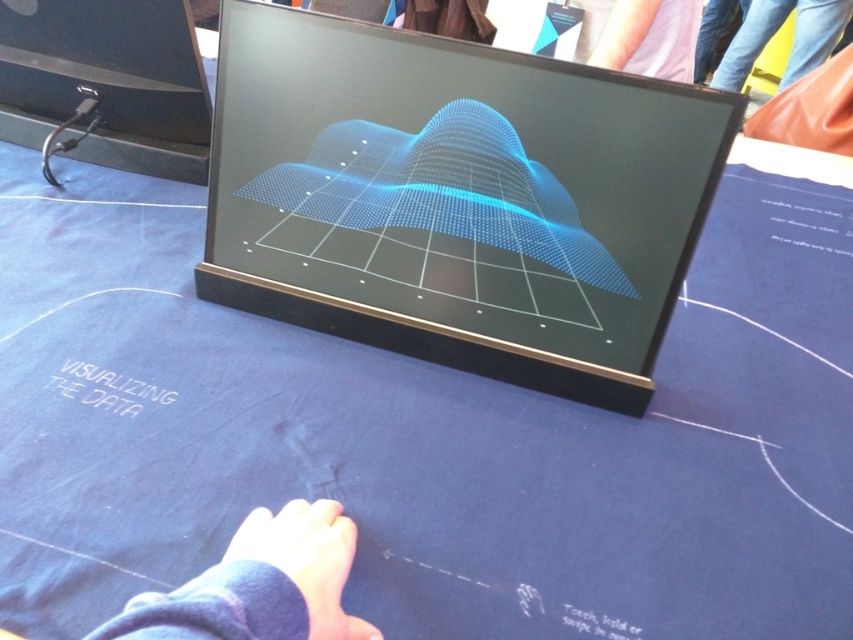
Does matte black laptop at center have a lesser height compared to jeans at upper right?

No, matte black laptop at center is not shorter than jeans at upper right.

What are the coordinates of `matte black laptop at center` in the screenshot? It's located at (456, 198).

Between point (303, 552) and point (782, 1), which one is positioned behind?

Point (782, 1)

Who is higher up, skinny blue fabric at lower center or jeans at upper right?

jeans at upper right

Between point (343, 516) and point (799, 38), which one is positioned in front?

Point (343, 516) is in front.

Locate an element on the screen. This screenshot has width=853, height=640. skinny blue fabric at lower center is located at coordinates (259, 584).

Is matte black laptop at center wider than skinny blue fabric at lower center?

Indeed, matte black laptop at center has a greater width compared to skinny blue fabric at lower center.

Is matte black laptop at center shorter than skinny blue fabric at lower center?

In fact, matte black laptop at center may be taller than skinny blue fabric at lower center.

Which is behind, point (619, 202) or point (337, 536)?

Positioned behind is point (619, 202).

You are a GUI agent. You are given a task and a screenshot of the screen. Output one action in this format:
    pyautogui.click(x=<x>, y=<y>)
    Task: Click on the matte black laptop at center
    Image resolution: width=853 pixels, height=640 pixels.
    Given the screenshot: What is the action you would take?
    pyautogui.click(x=456, y=198)